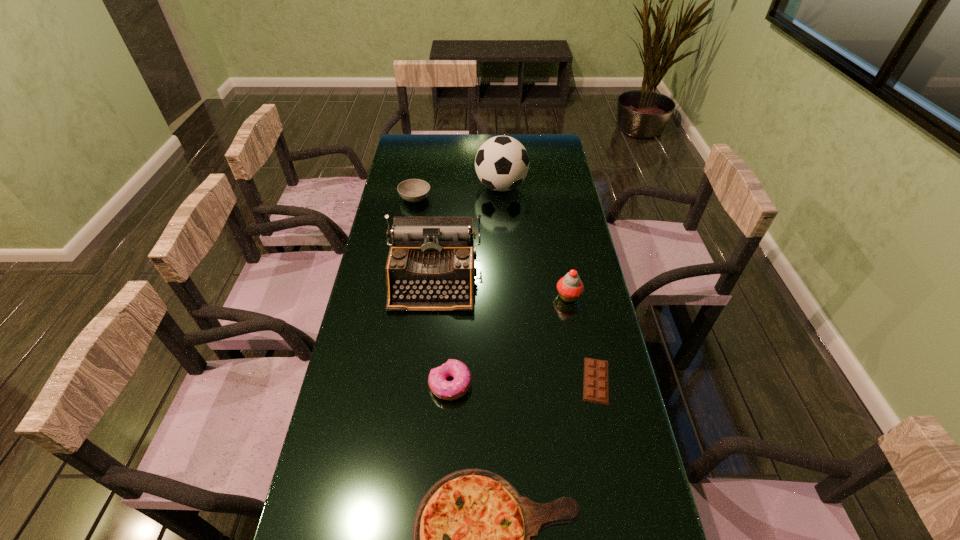
Locate an element on the screen. free space located on the back of the doughnut is located at coordinates (457, 266).

Locate an element on the screen. Image resolution: width=960 pixels, height=540 pixels. blank area located 0.290m on the left of the shortest object is located at coordinates (473, 381).

Find the location of a particular element. The width and height of the screenshot is (960, 540). typewriter at the left edge is located at coordinates (431, 264).

Image resolution: width=960 pixels, height=540 pixels. In order to click on bowl that is at the left edge in this screenshot , I will do `click(413, 190)`.

The height and width of the screenshot is (540, 960). Identify the location of cupcake present at the right edge. (570, 287).

Where is `chocolate bar that is at the right edge`? Image resolution: width=960 pixels, height=540 pixels. chocolate bar that is at the right edge is located at coordinates (596, 372).

Find the location of `vacant space at the far edge of the desktop`. vacant space at the far edge of the desktop is located at coordinates (433, 156).

Where is `vacant space at the left edge of the desktop`? The height and width of the screenshot is (540, 960). vacant space at the left edge of the desktop is located at coordinates (398, 321).

The width and height of the screenshot is (960, 540). I want to click on free location at the right edge, so click(549, 215).

This screenshot has height=540, width=960. Find the location of `vacant space at the far left corner of the desktop`. vacant space at the far left corner of the desktop is located at coordinates (418, 150).